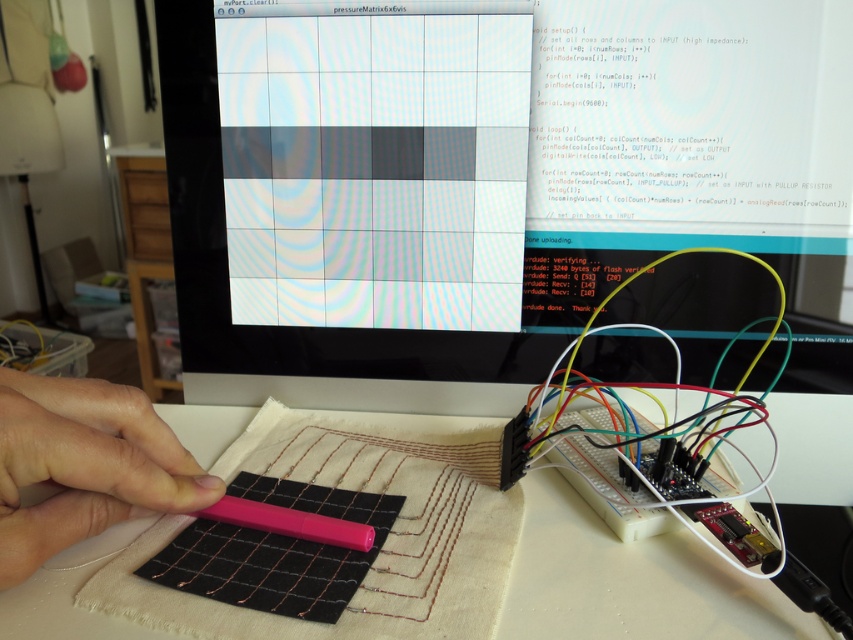
Question: Which point is farther to the camera?

Choices:
 (A) (256, 529)
 (B) (39, 502)

Answer: (A)

Question: Can you confirm if matte black screen at center is smaller than pink matte pen at center?

Choices:
 (A) no
 (B) yes

Answer: (A)

Question: Can you confirm if matte black screen at center is bigger than pink matte pen at center?

Choices:
 (A) yes
 (B) no

Answer: (A)

Question: Which point is closer to the camera taking this photo?

Choices:
 (A) (22, 560)
 (B) (625, 259)

Answer: (A)

Question: Is pink matte pen at lower left thinner than pink matte pen at center?

Choices:
 (A) yes
 (B) no

Answer: (A)

Question: Among these points, which one is farthest from the camera?

Choices:
 (A) (218, 29)
 (B) (248, 524)
 (C) (596, 532)
 (D) (93, 401)

Answer: (A)